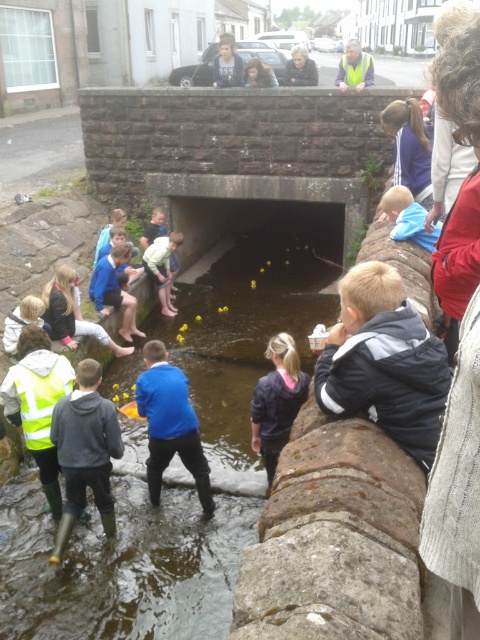
Question: Can you confirm if matte black jacket at lower left is wider than yellow reflective vest at upper center?

Choices:
 (A) no
 (B) yes

Answer: (A)

Question: Is yellow rubber ducks at center to the left of light blue shirt at center from the viewer's perspective?

Choices:
 (A) yes
 (B) no

Answer: (B)

Question: Which point appears farthest from the camera in this image?

Choices:
 (A) (61, 424)
 (B) (66, 285)
 (C) (163, 301)
 (D) (430, 385)

Answer: (C)

Question: Which of these objects is positioned farthest from the light blue shirt at center?

Choices:
 (A) black jacket at lower center
 (B) blue fabric jacket at center
 (C) dark blue hoodie at center
 (D) yellow rubber ducks at center

Answer: (A)

Question: Which of the following is the farthest from the observer?

Choices:
 (A) yellow rubber ducks at center
 (B) black jacket at lower center
 (C) matte black jacket at upper center

Answer: (C)

Question: Is dark blue hoodie at center below yellow reflective vest at upper center?

Choices:
 (A) yes
 (B) no

Answer: (A)